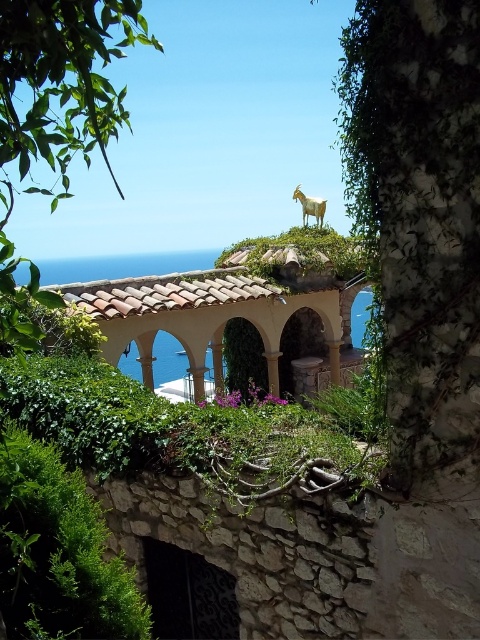
Is terracotta tiled gazebo at center bigger than golden metallic goat at upper center?

Yes.

What do you see at coordinates (228, 289) in the screenshot? I see `terracotta tiled gazebo at center` at bounding box center [228, 289].

Between point (72, 291) and point (321, 212), which one is positioned in front?

Point (72, 291)

Where is `terracotta tiled gazebo at center`? This screenshot has height=640, width=480. terracotta tiled gazebo at center is located at coordinates (228, 289).

Which of these two, terracotta tiled gazebo at center or green leafy plant at lower left, stands shorter?

With less height is green leafy plant at lower left.

Is point (361, 264) positioned before point (96, 508)?

No.

Is point (312, 276) closer to viewer compared to point (83, 522)?

No, it is behind (83, 522).

Identify the location of terracotta tiled gazebo at center. click(228, 289).

How much distance is there between green leafy plant at lower left and golden metallic goat at upper center?

green leafy plant at lower left is 15.89 meters from golden metallic goat at upper center.

Measure the distance between point (40,625) and camera.

Point (40,625) and camera are 9.38 feet apart.

Measure the distance between green leafy plant at lower left and camera.

green leafy plant at lower left and camera are 2.73 meters apart from each other.

In order to click on green leafy plant at lower left in this screenshot , I will do [59, 552].